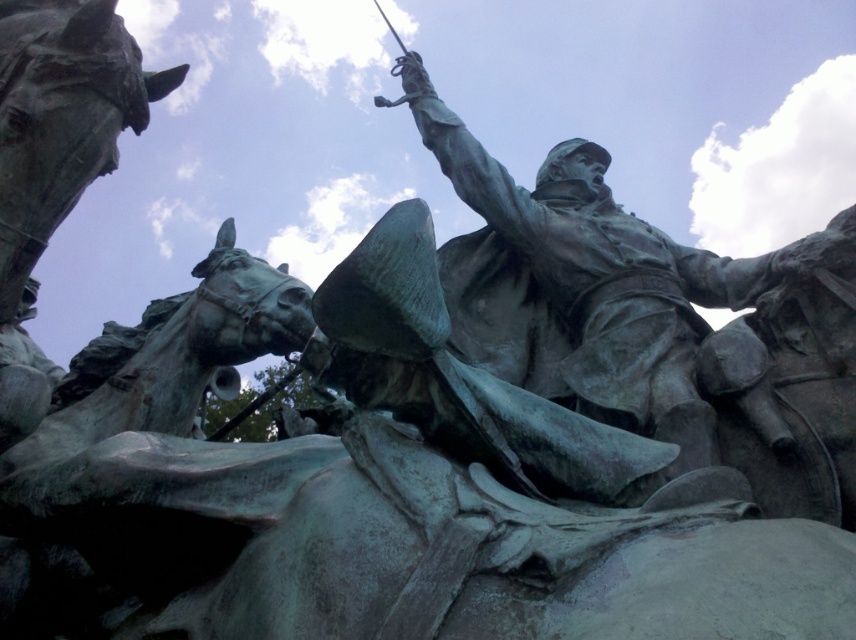
You are an art conservator examining the bronze sculpture. You notice two points on the sculpture marked at coordinates point [593,317] and point [3,33]. Which point is closer to the camera lens?

Point [3,33] is closer to the camera lens because the description states that point [593,317] is further away from it.

You are an art conservator examining the green patina statue at center. Based on its coordinates, is it positioned closer to the top or bottom of the image?

The green patina statue at center is located at point (611, 288). Since the y coordinate is 0.716, which is closer to 1.0, it is positioned closer to the bottom of the image.

You are standing in front of a sculpture garden and see the green patina statue at center. If you want to get a closer look, how many steps would you need to take to reach it if each step covers approximately 2.5 feet?

The green patina statue at center is 205.34 feet away. Dividing the distance by the step length of 2.5 feet gives approximately 82.136 steps. Since you can only take whole steps, you would need to take 83 steps to reach the green patina statue at center.